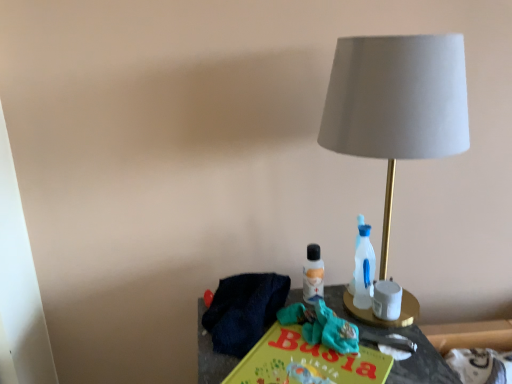
Identify the location of vacant space situated above yellow matte paper at center (from a real-world perspective). (311, 360).